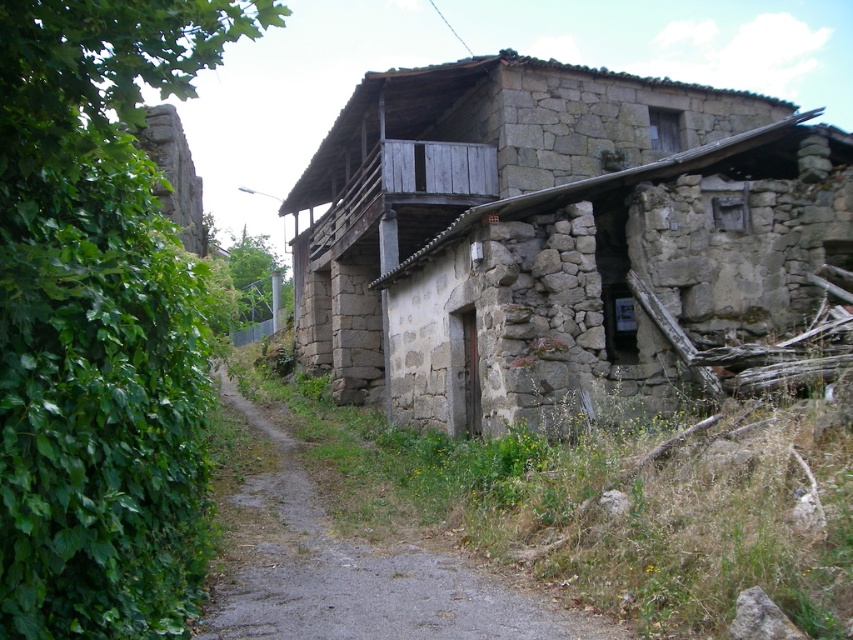
Who is positioned more to the left, gray stone house at center or dirt/gravel path at center?

dirt/gravel path at center is more to the left.

Which is behind, point (347, 314) or point (457, 588)?

The point (347, 314) is behind.

Which is behind, point (296, 326) or point (277, 509)?

Positioned behind is point (296, 326).

Identify the location of gray stone house at center. This screenshot has width=853, height=640. (550, 234).

Can you confirm if gray stone house at center is shorter than green leafy ivy at left?

No.

What do you see at coordinates (550, 234) in the screenshot? I see `gray stone house at center` at bounding box center [550, 234].

Which is behind, point (706, 305) or point (13, 269)?

Point (706, 305)

This screenshot has height=640, width=853. I want to click on gray stone house at center, so click(550, 234).

Based on the photo, does green leafy ivy at left have a lesser height compared to dirt/gravel path at center?

No.

Is point (53, 449) positioned before point (277, 627)?

Yes.

Describe the element at coordinates (99, 321) in the screenshot. I see `green leafy ivy at left` at that location.

Locate an element on the screen. The image size is (853, 640). green leafy ivy at left is located at coordinates (99, 321).